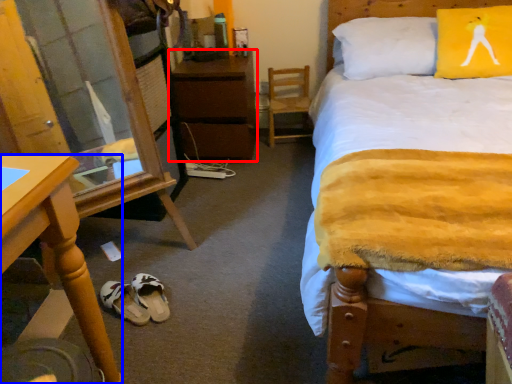
Question: Which object is closer to the camera taking this photo, nightstand (highlighted by a red box) or desk (highlighted by a blue box)?

Choices:
 (A) nightstand
 (B) desk

Answer: (B)